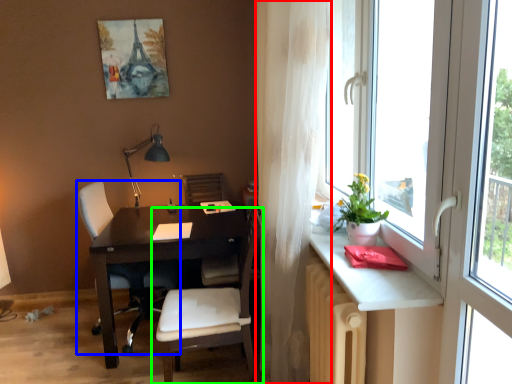
Question: Based on their relative distances, which object is nearer to curtain (highlighted by a red box)? Choose from chair (highlighted by a blue box) and chair (highlighted by a green box).

Choices:
 (A) chair
 (B) chair

Answer: (B)